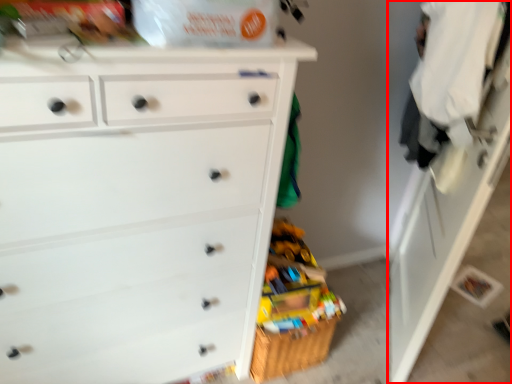
Question: From the image's perspective, where is dresser (annotated by the red box) located relative to chest of drawers?

Choices:
 (A) below
 (B) above

Answer: (B)